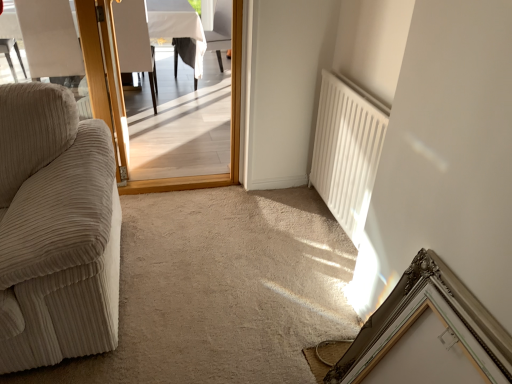
Question: Is beige corduroy armchair at left, positioned as the 1th armchair in left-to-right order, bigger than white fabric chair at upper center?

Choices:
 (A) yes
 (B) no

Answer: (B)

Question: Is the position of beige corduroy armchair at left, positioned as the 1th armchair in left-to-right order, more distant than that of white fabric chair at upper center?

Choices:
 (A) yes
 (B) no

Answer: (B)

Question: Considering the relative sizes of beige corduroy armchair at left, marked as the 2th armchair in a right-to-left arrangement, and white fabric chair at upper center in the image provided, is beige corduroy armchair at left, marked as the 2th armchair in a right-to-left arrangement, smaller than white fabric chair at upper center?

Choices:
 (A) yes
 (B) no

Answer: (A)

Question: Does beige corduroy armchair at left, positioned as the 1th armchair in left-to-right order, have a lesser width compared to white fabric chair at upper center?

Choices:
 (A) no
 (B) yes

Answer: (B)

Question: Is the position of beige corduroy armchair at left, marked as the 2th armchair in a right-to-left arrangement, less distant than that of white fabric chair at upper center?

Choices:
 (A) no
 (B) yes

Answer: (B)

Question: Would you say white fabric chair at upper center is to the left or to the right of white matte radiator at right in the picture?

Choices:
 (A) left
 (B) right

Answer: (A)

Question: Based on their sizes in the image, would you say white fabric chair at upper center is bigger or smaller than white matte radiator at right?

Choices:
 (A) big
 (B) small

Answer: (A)

Question: Looking at their shapes, would you say white fabric chair at upper center is wider or thinner than white matte radiator at right?

Choices:
 (A) wide
 (B) thin

Answer: (A)

Question: From a real-world perspective, is white fabric chair at upper center above or below white matte radiator at right?

Choices:
 (A) above
 (B) below

Answer: (A)

Question: From a real-world perspective, relative to wooden door at center, is silver ornate picture frame at lower right vertically above or below?

Choices:
 (A) above
 (B) below

Answer: (B)

Question: Considering the relative positions of silver ornate picture frame at lower right and wooden door at center in the image provided, is silver ornate picture frame at lower right to the left or to the right of wooden door at center?

Choices:
 (A) left
 (B) right

Answer: (B)

Question: Would you say silver ornate picture frame at lower right is inside or outside wooden door at center?

Choices:
 (A) outside
 (B) inside

Answer: (A)

Question: Based on their sizes in the image, would you say silver ornate picture frame at lower right is bigger or smaller than wooden door at center?

Choices:
 (A) small
 (B) big

Answer: (B)

Question: From the image's perspective, is white fabric chair at upper center located above or below wooden screen door at left?

Choices:
 (A) below
 (B) above

Answer: (B)

Question: Considering the positions of white fabric chair at upper center and wooden screen door at left in the image, is white fabric chair at upper center taller or shorter than wooden screen door at left?

Choices:
 (A) tall
 (B) short

Answer: (B)